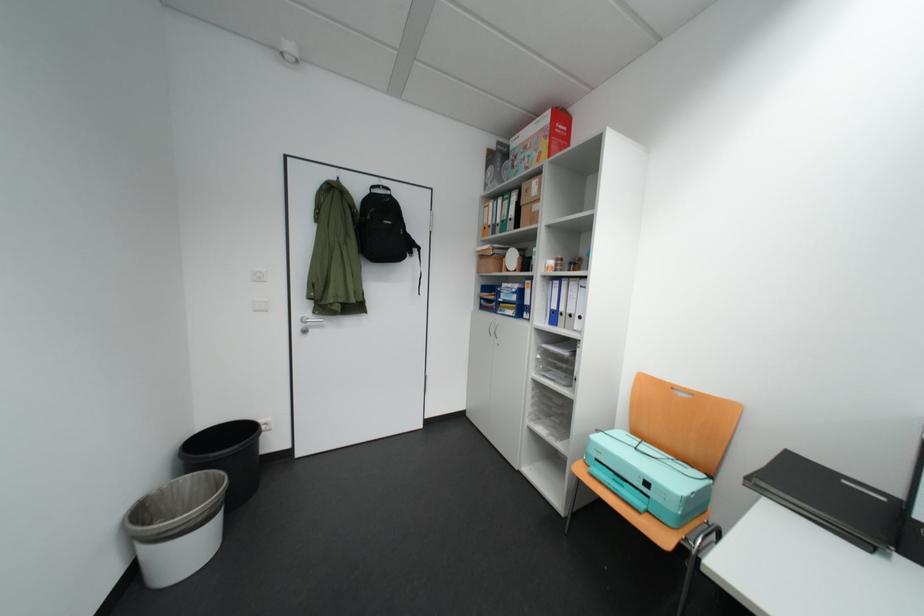
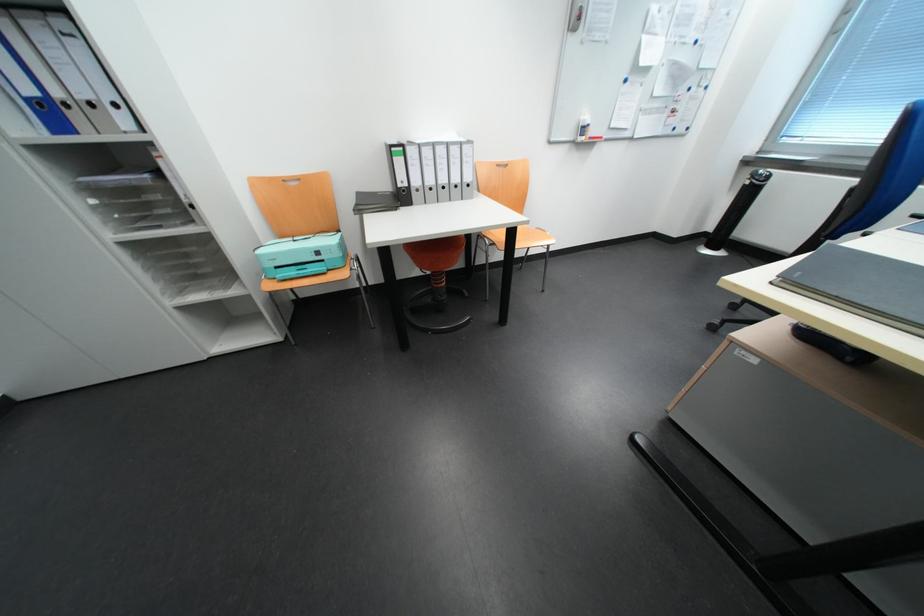
The first image is from the beginning of the video and the second image is from the end. How did the camera likely rotate when shooting the video?

The camera rotated toward right-down.